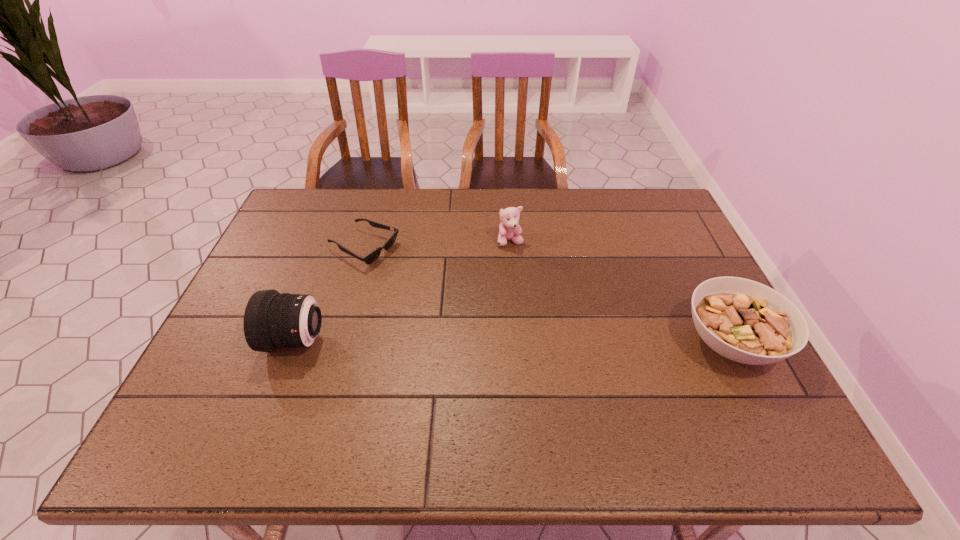
Locate an element on the screen. This screenshot has height=540, width=960. the tallest object is located at coordinates 272,320.

Where is `the rightmost object`? The height and width of the screenshot is (540, 960). the rightmost object is located at coordinates (745, 321).

Locate an element on the screen. The width and height of the screenshot is (960, 540). the second object from right to left is located at coordinates (x=509, y=229).

Identify the location of sunglasses. The image size is (960, 540). (373, 255).

Where is `free space located 0.080m at the front element of the tallest object`? free space located 0.080m at the front element of the tallest object is located at coordinates (236, 340).

This screenshot has height=540, width=960. What are the coordinates of `vacant space situated 0.200m on the back of the rightmost object` in the screenshot? It's located at (686, 256).

I want to click on vacant area situated at the face of the teddy bear, so click(497, 354).

You are a GUI agent. You are given a task and a screenshot of the screen. Output one action in this format:
    pyautogui.click(x=<x>, y=<y>)
    Task: Click on the free space located at the face of the teddy bear
    
    Given the screenshot: What is the action you would take?
    click(506, 279)

You are a GUI agent. You are given a task and a screenshot of the screen. Output one action in this format:
    pyautogui.click(x=<x>, y=<y>)
    Task: Click on the vacant region located 0.320m at the face of the teddy bear
    The width and height of the screenshot is (960, 540).
    Given the screenshot: What is the action you would take?
    pyautogui.click(x=500, y=331)

In order to click on vacant space located on the front-facing side of the shortest object in this screenshot , I will do `click(405, 266)`.